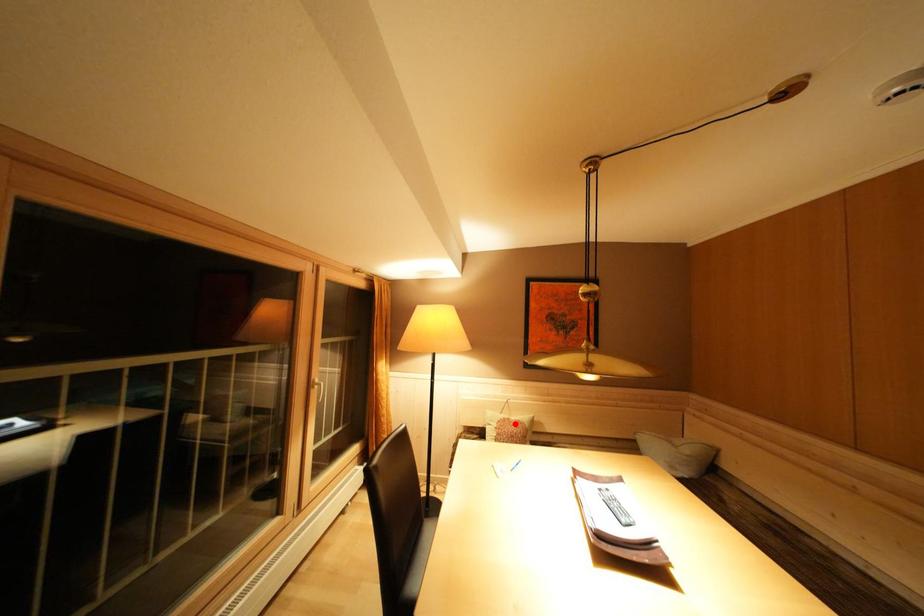
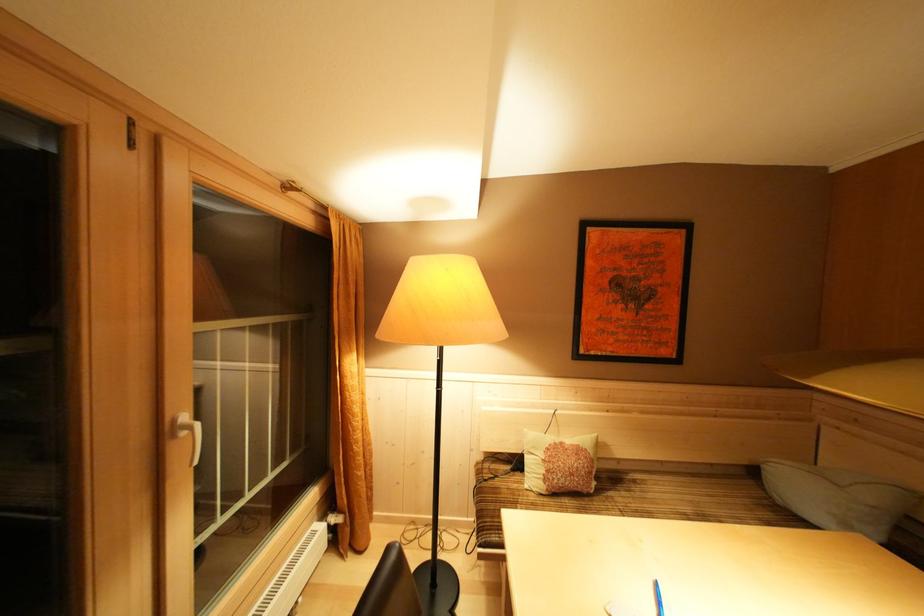
The point at the highlighted location is marked in the first image. Where is the corresponding point in the second image?

(568, 448)